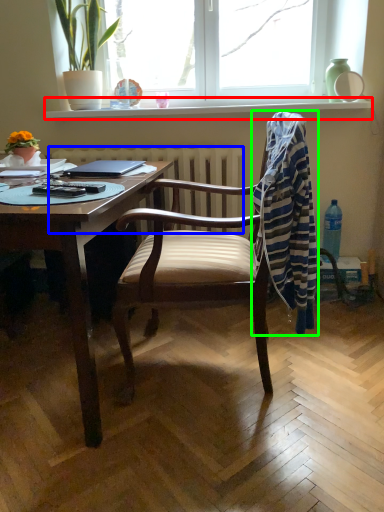
Question: Estimate the real-world distances between objects in this image. Which object is farther from window sill (highlighted by a red box), radiator (highlighted by a blue box) or laundry (highlighted by a green box)?

Choices:
 (A) radiator
 (B) laundry

Answer: (B)